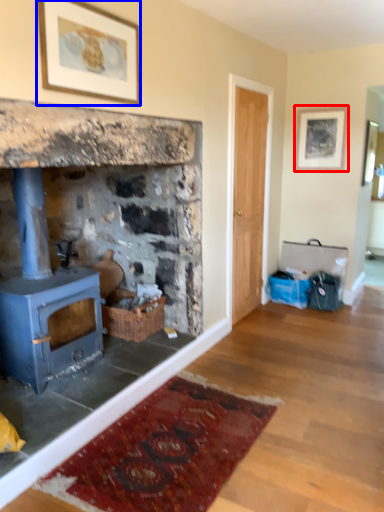
Question: Which object appears farthest to the camera in this image, picture frame (highlighted by a red box) or picture frame (highlighted by a blue box)?

Choices:
 (A) picture frame
 (B) picture frame

Answer: (A)